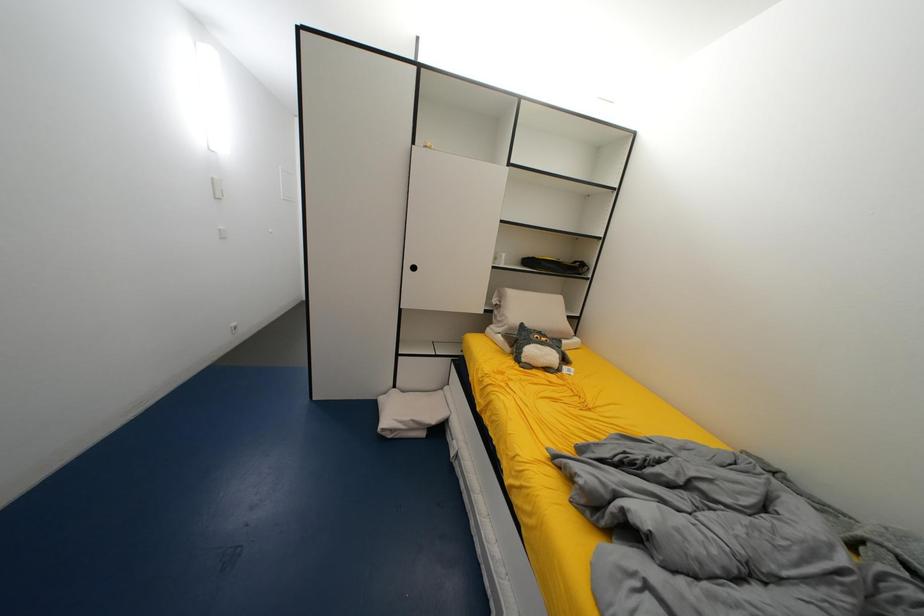
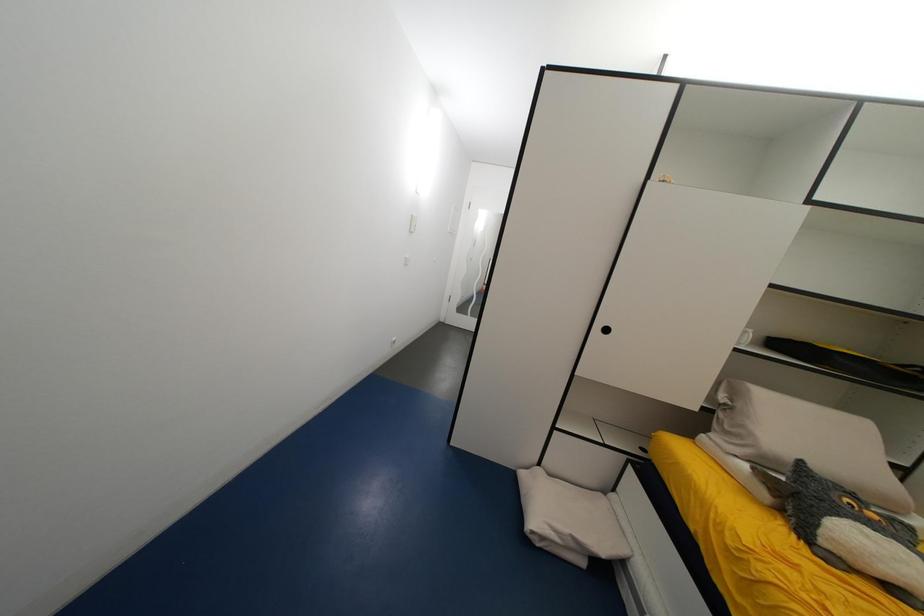
The images are taken continuously from a first-person perspective. In which direction are you moving?

The cameraman moved toward left, forward.